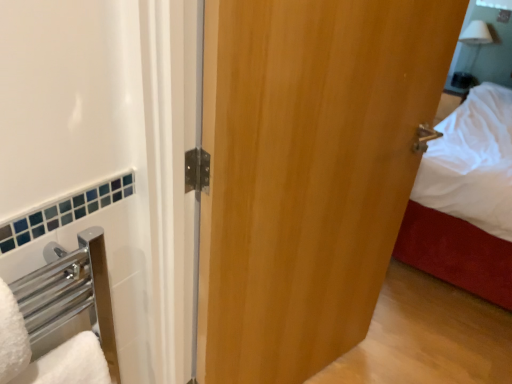
Image resolution: width=512 pixels, height=384 pixels. I want to click on white fluffy bath towel at lower left, so click(12, 337).

This screenshot has width=512, height=384. I want to click on wooden door at center, so click(308, 172).

Are white fluffy bath towel at lower left and wooden door at center far apart?

white fluffy bath towel at lower left is near wooden door at center, not far away.

Is white fluffy bath towel at lower left shorter than wooden door at center?

Indeed, white fluffy bath towel at lower left has a lesser height compared to wooden door at center.

Which is more to the left, white fluffy bath towel at lower left or wooden door at center?

white fluffy bath towel at lower left.

Is white fluffy bath towel at lower left located outside white glossy mirror at upper right?

Absolutely, white fluffy bath towel at lower left is external to white glossy mirror at upper right.

How many degrees apart are the facing directions of white fluffy bath towel at lower left and white glossy mirror at upper right?

There is a 87.1-degree angle between the facing directions of white fluffy bath towel at lower left and white glossy mirror at upper right.

Measure the distance from white fluffy bath towel at lower left to white glossy mirror at upper right.

A distance of 3.76 meters exists between white fluffy bath towel at lower left and white glossy mirror at upper right.

Are white fluffy bath towel at lower left and white glossy mirror at upper right beside each other?

No.

From a real-world perspective, is white glossy mirror at upper right on wooden door at center?

Yes, from a real-world perspective, white glossy mirror at upper right is over wooden door at center

Is white glossy mirror at upper right in front of or behind wooden door at center in the image?

In the image, white glossy mirror at upper right appears behind wooden door at center.

In the scene shown: Is white glossy mirror at upper right next to wooden door at center?

There is a gap between white glossy mirror at upper right and wooden door at center.

I want to click on mirror above the wooden door at center (from the image's perspective), so click(x=492, y=45).

Which object is further away from the camera, wooden door at center or white fluffy bath towel at lower left?

wooden door at center is further away from the camera.

In the scene shown: Is wooden door at center oriented away from white fluffy bath towel at lower left?

No, white fluffy bath towel at lower left is not at the back of wooden door at center.

Considering the relative sizes of wooden door at center and white fluffy bath towel at lower left in the image provided, is wooden door at center bigger than white fluffy bath towel at lower left?

Indeed, wooden door at center has a larger size compared to white fluffy bath towel at lower left.

Is wooden door at center not close to white fluffy bath towel at lower left?

wooden door at center is actually quite close to white fluffy bath towel at lower left.

In the scene shown: Considering the positions of objects wooden door at center and white glossy mirror at upper right in the image provided, who is more to the right, wooden door at center or white glossy mirror at upper right?

white glossy mirror at upper right is more to the right.

Is wooden door at center located outside white glossy mirror at upper right?

Indeed, wooden door at center is completely outside white glossy mirror at upper right.

Would you say wooden door at center is a long distance from white glossy mirror at upper right?

That's right, there is a large distance between wooden door at center and white glossy mirror at upper right.

From a real-world perspective, is wooden door at center beneath white glossy mirror at upper right?

Yes, from a real-world perspective, wooden door at center is under white glossy mirror at upper right.

This screenshot has width=512, height=384. In order to click on mirror behind the white fluffy bath towel at lower left in this screenshot , I will do `click(492, 45)`.

Between point (478, 6) and point (8, 294), which one is positioned behind?

The point (478, 6) is behind.

Are white glossy mirror at upper right and white fluffy bath towel at lower left far apart?

That's right, there is a large distance between white glossy mirror at upper right and white fluffy bath towel at lower left.

From the image's perspective, which is above, white glossy mirror at upper right or white fluffy bath towel at lower left?

white glossy mirror at upper right, from the image's perspective.

The height and width of the screenshot is (384, 512). Find the location of `bath towel lying on the left of wooden door at center`. bath towel lying on the left of wooden door at center is located at coordinates pos(12,337).

The height and width of the screenshot is (384, 512). Find the location of `mirror that appears below the white fluffy bath towel at lower left (from a real-world perspective)`. mirror that appears below the white fluffy bath towel at lower left (from a real-world perspective) is located at coordinates (492, 45).

Based on their spatial positions, is white glossy mirror at upper right or white fluffy bath towel at lower left closer to wooden door at center?

white fluffy bath towel at lower left is closer to wooden door at center.

From the image, which object appears to be nearer to white glossy mirror at upper right, white fluffy bath towel at lower left or wooden door at center?

wooden door at center.

When comparing their distances from white fluffy bath towel at lower left, does white glossy mirror at upper right or wooden door at center seem further?

white glossy mirror at upper right lies further to white fluffy bath towel at lower left than the other object.

Which object lies further to the anchor point white glossy mirror at upper right, wooden door at center or white fluffy bath towel at lower left?

The object further to white glossy mirror at upper right is white fluffy bath towel at lower left.

When comparing their distances from wooden door at center, does white fluffy bath towel at lower left or white glossy mirror at upper right seem closer?

Based on the image, white fluffy bath towel at lower left appears to be nearer to wooden door at center.

Considering their positions, is wooden door at center positioned further to white fluffy bath towel at lower left than white glossy mirror at upper right?

white glossy mirror at upper right lies further to white fluffy bath towel at lower left than the other object.

Where is `door located between white fluffy bath towel at lower left and white glossy mirror at upper right in the depth direction`? Image resolution: width=512 pixels, height=384 pixels. door located between white fluffy bath towel at lower left and white glossy mirror at upper right in the depth direction is located at coordinates (308, 172).